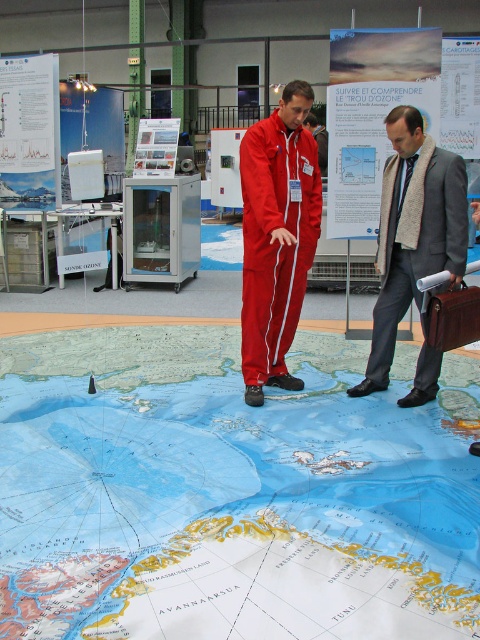
You are standing in the conference hall and notice two points marked on the Arctic map. The first point is at coordinates point (408, 625) and the second at point (403, 177). Which point is closer to you from your current position?

Point (408, 625) is in front of point (403, 177), so it is closer to you.

You are attending a conference and need to present a detailed Arctic map. You see the blue paper map at center and the matte red jumpsuit at center in the room. Which object would you choose for your presentation, and why?

The blue paper map at center is larger in size compared to the matte red jumpsuit at center, making it more suitable for a presentation as it can be easily viewed by the audience.